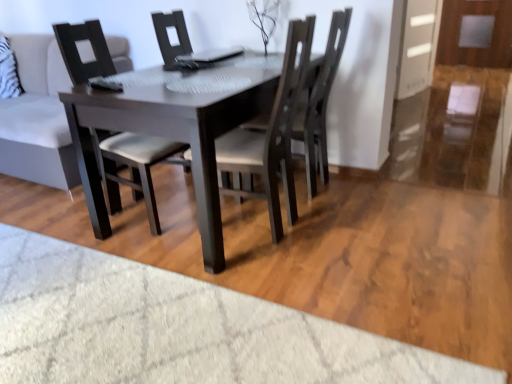
Question: Which direction should I rotate to look at matte black chair at center, the 3th chair in the right-to-left sequence?

Choices:
 (A) right
 (B) left

Answer: (B)

Question: Is transparent glass door at right not near matte black chair at center, which is the 1th chair from left to right?

Choices:
 (A) no
 (B) yes

Answer: (B)

Question: Can you confirm if transparent glass door at right is shorter than matte black chair at center, which is the 1th chair from left to right?

Choices:
 (A) yes
 (B) no

Answer: (A)

Question: Is transparent glass door at right aimed at matte black chair at center, which is the 1th chair from left to right?

Choices:
 (A) no
 (B) yes

Answer: (A)

Question: Is transparent glass door at right wider than matte black chair at center, the 3th chair in the right-to-left sequence?

Choices:
 (A) no
 (B) yes

Answer: (A)

Question: Is transparent glass door at right thinner than matte black chair at center, which is the 1th chair from left to right?

Choices:
 (A) no
 (B) yes

Answer: (B)

Question: Can you confirm if transparent glass door at right is bigger than matte black chair at center, the 3th chair in the right-to-left sequence?

Choices:
 (A) no
 (B) yes

Answer: (A)

Question: Is matte black chair at center, which is the 1th chair from left to right, bigger than transparent glass door at right?

Choices:
 (A) yes
 (B) no

Answer: (A)

Question: From a real-world perspective, does matte black chair at center, the 3th chair in the right-to-left sequence, stand above transparent glass door at right?

Choices:
 (A) yes
 (B) no

Answer: (A)

Question: Is the position of matte black chair at center, which is the 1th chair from left to right, more distant than that of transparent glass door at right?

Choices:
 (A) no
 (B) yes

Answer: (A)

Question: Is transparent glass door at right inside matte black chair at center, which is the 1th chair from left to right?

Choices:
 (A) yes
 (B) no

Answer: (B)

Question: Is matte black chair at center, which is the 1th chair from left to right, far away from transparent glass door at right?

Choices:
 (A) yes
 (B) no

Answer: (A)

Question: Is matte black chair at center, which is the 1th chair from left to right, next to transparent glass door at right and touching it?

Choices:
 (A) yes
 (B) no

Answer: (B)

Question: Can you confirm if transparent glass door at right is positioned to the right of dark wood chair at center, which is counted as the second chair, starting from the left?

Choices:
 (A) yes
 (B) no

Answer: (A)